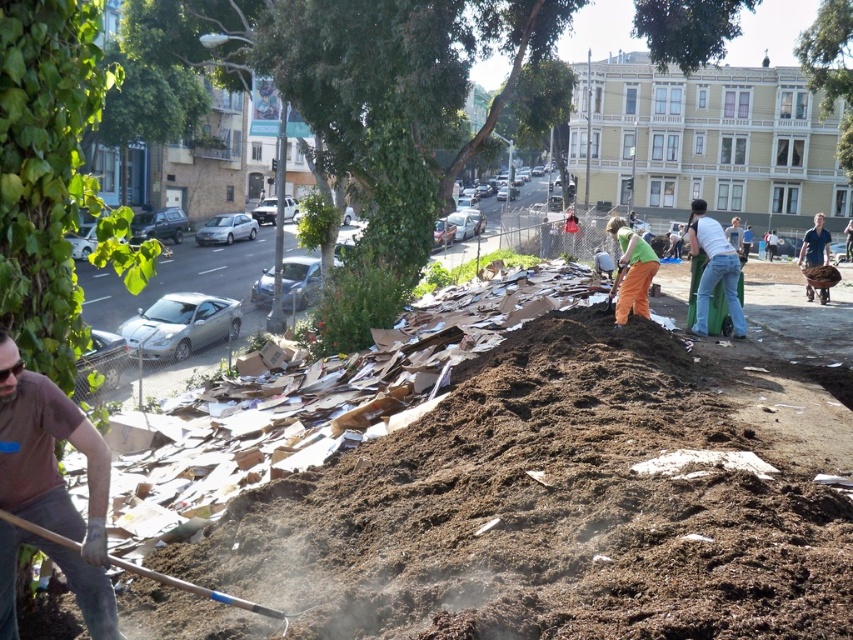
Is green fabric shirt at center bigger than wooden handle shovel at lower left?

Yes, green fabric shirt at center is bigger than wooden handle shovel at lower left.

This screenshot has height=640, width=853. I want to click on green fabric shirt at center, so click(x=631, y=272).

Where is `green fabric shirt at center`? This screenshot has height=640, width=853. green fabric shirt at center is located at coordinates (631, 272).

Between green denim jeans at center and wooden handle shovel at lower left, which one has less height?

Standing shorter between the two is wooden handle shovel at lower left.

Which is behind, point (711, 285) or point (45, 529)?

The point (711, 285) is behind.

At what (x,y) coordinates should I click in order to perform the action: click on green denim jeans at center. Please return your answer as a coordinate pair (x, y). Looking at the image, I should click on (714, 269).

Is brown leather gloves at lower left bigger than green denim jeans at center?

Actually, brown leather gloves at lower left might be smaller than green denim jeans at center.

In the scene shown: Can you confirm if brown leather gloves at lower left is positioned to the left of green denim jeans at center?

Indeed, brown leather gloves at lower left is positioned on the left side of green denim jeans at center.

This screenshot has width=853, height=640. Describe the element at coordinates (50, 492) in the screenshot. I see `brown leather gloves at lower left` at that location.

Where is `brown leather gloves at lower left`? brown leather gloves at lower left is located at coordinates coord(50,492).